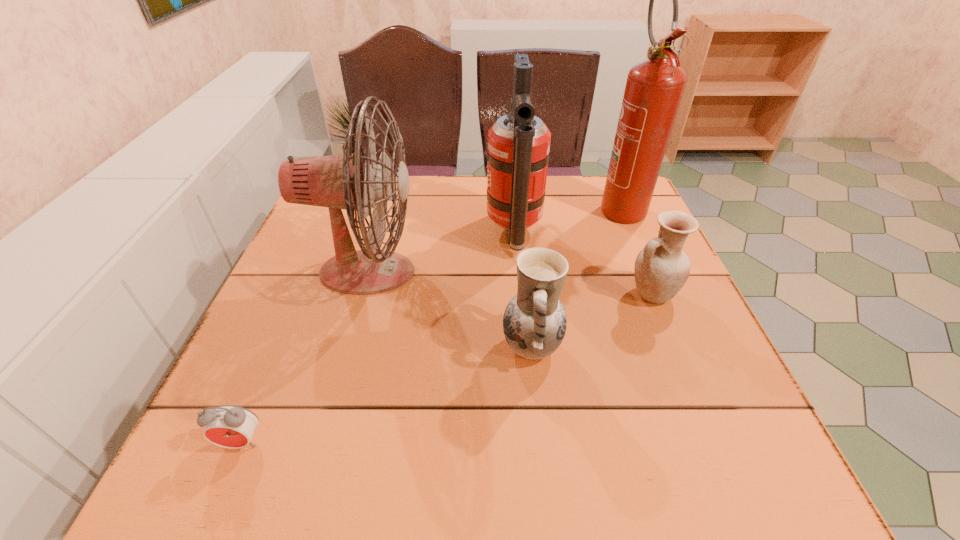
Image resolution: width=960 pixels, height=540 pixels. I want to click on the right fire extinguisher, so click(654, 87).

Locate an element on the screen. the taller fire extinguisher is located at coordinates (654, 87).

You are a GUI agent. You are given a task and a screenshot of the screen. Output one action in this format:
    pyautogui.click(x=<x>, y=<y>)
    Task: Click on the left fire extinguisher
    
    Given the screenshot: What is the action you would take?
    pyautogui.click(x=518, y=151)

The height and width of the screenshot is (540, 960). I want to click on fan, so click(x=340, y=181).

I want to click on the left pottery, so click(534, 323).

Identify the location of the right pottery. (661, 268).

You are a GUI agent. You are given a task and a screenshot of the screen. Output one action in this format:
    pyautogui.click(x=<x>, y=<y>)
    Task: Click on the nearest object
    The width and height of the screenshot is (960, 540).
    Given the screenshot: What is the action you would take?
    click(x=228, y=426)

The width and height of the screenshot is (960, 540). Identify the location of alarm clock. (228, 426).

At what (x,y) coordinates should I click in order to perform the action: click on blank area located from the nozzle of the right fire extinguisher. Please return your answer as a coordinate pair (x, y). This screenshot has height=540, width=960. Looking at the image, I should click on (666, 312).

Identify the location of vacant space located on the front label side of the left fire extinguisher. click(354, 234).